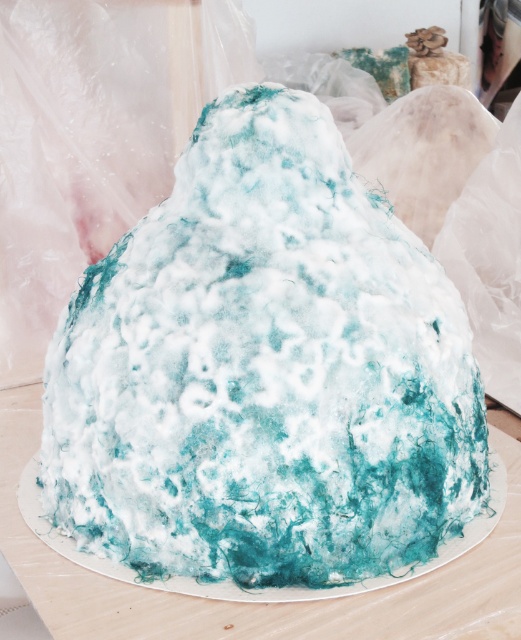
You are a baker who wants to place both the turquoise felt cake at center and the white textured cake at center on a shelf. The shelf has a height limit of 10 cm. Can both cakes fit vertically without exceeding the height limit?

The turquoise felt cake at center is thinner than the white textured cake at center. Since the turquoise felt cake is thinner, it is possible that both cakes could fit vertically on the shelf if the combined height of both cakes does not exceed 10 cm. However, without knowing the exact thickness of each, we cannot confirm for sure.

Looking at this image, you are a baker who needs to stack the turquoise felt cake at center and the white textured cake at center. Which cake should be placed at the bottom to ensure stability?

The turquoise felt cake at center should be placed at the bottom because it has a greater height compared to the white textured cake at center, providing a more stable base.